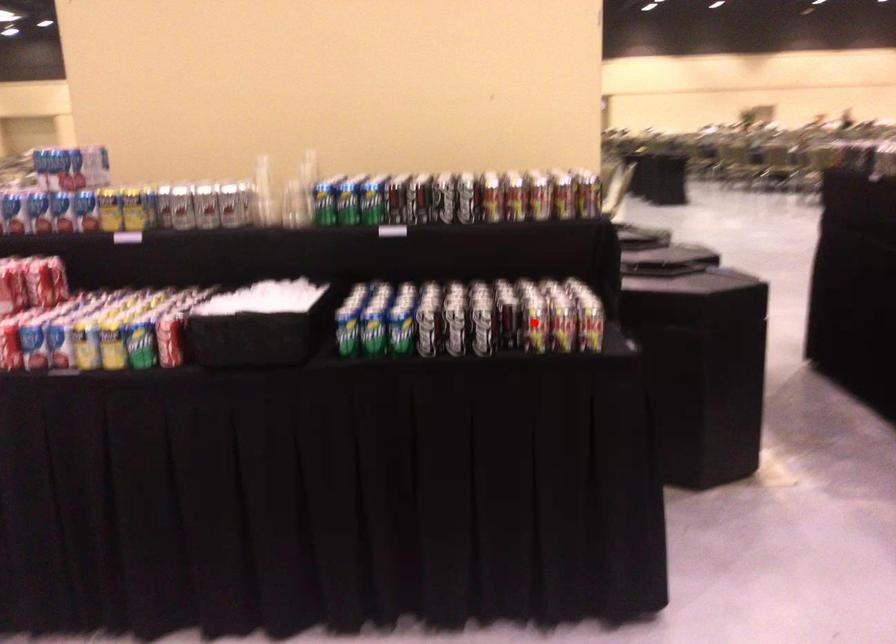
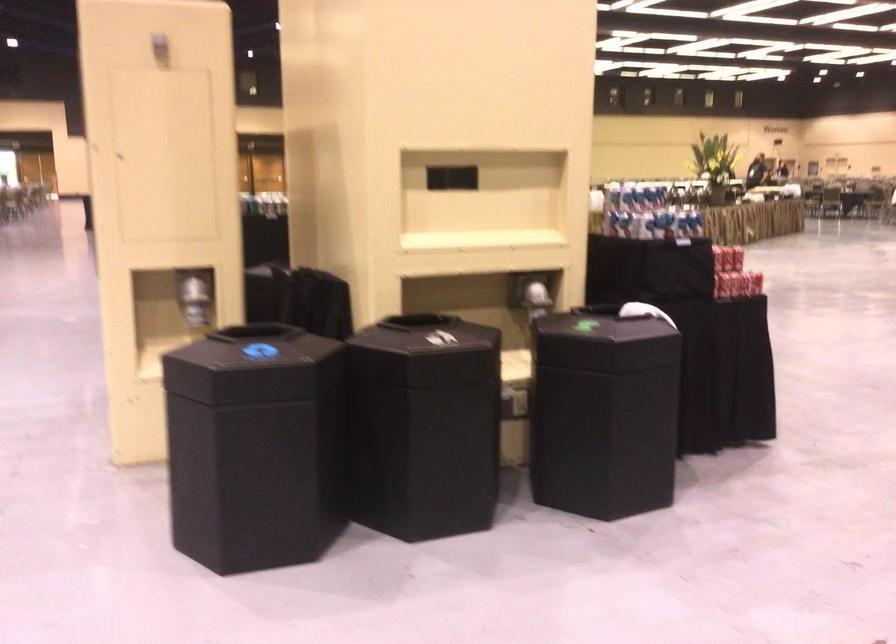
Question: I am providing you with two images of the same scene from different viewpoints. A red point is marked on the first image. Can you still see the location of the red point in image 2?

Choices:
 (A) Yes
 (B) No

Answer: (B)